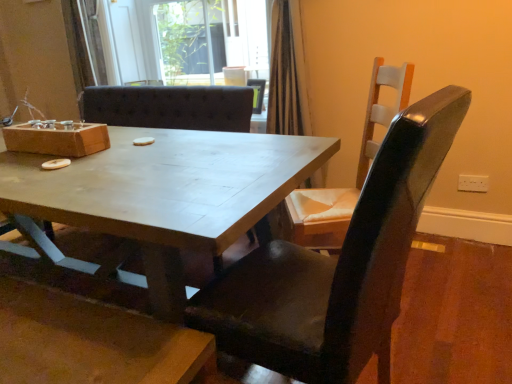
Question: Is wooden chair at right, acting as the first chair starting from the back, inside the boundaries of matte wooden table at center, or outside?

Choices:
 (A) inside
 (B) outside

Answer: (B)

Question: Relative to matte wooden table at center, is wooden chair at right, acting as the second chair starting from the front, in front or behind?

Choices:
 (A) behind
 (B) front

Answer: (A)

Question: Which is nearer to the wooden box at upper left?

Choices:
 (A) transparent glass door at upper center
 (B) wooden chair at right, acting as the second chair starting from the front
 (C) matte black chair at center, which appears as the first chair when viewed from the front
 (D) matte wooden table at center

Answer: (D)

Question: Which is farther from the wooden box at upper left?

Choices:
 (A) transparent glass door at upper center
 (B) matte black chair at center, the second chair positioned from the back
 (C) matte wooden table at center
 (D) wooden chair at right, acting as the first chair starting from the back

Answer: (A)